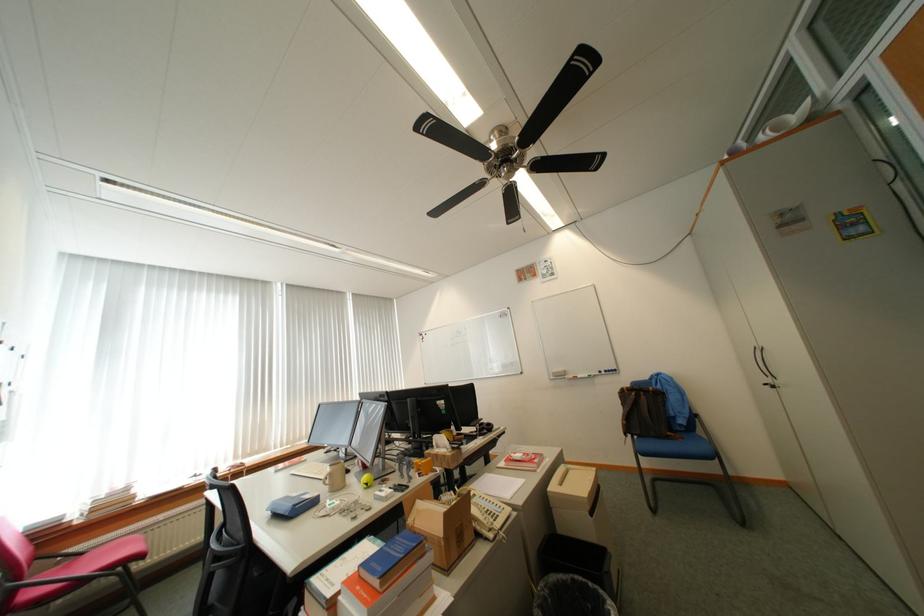
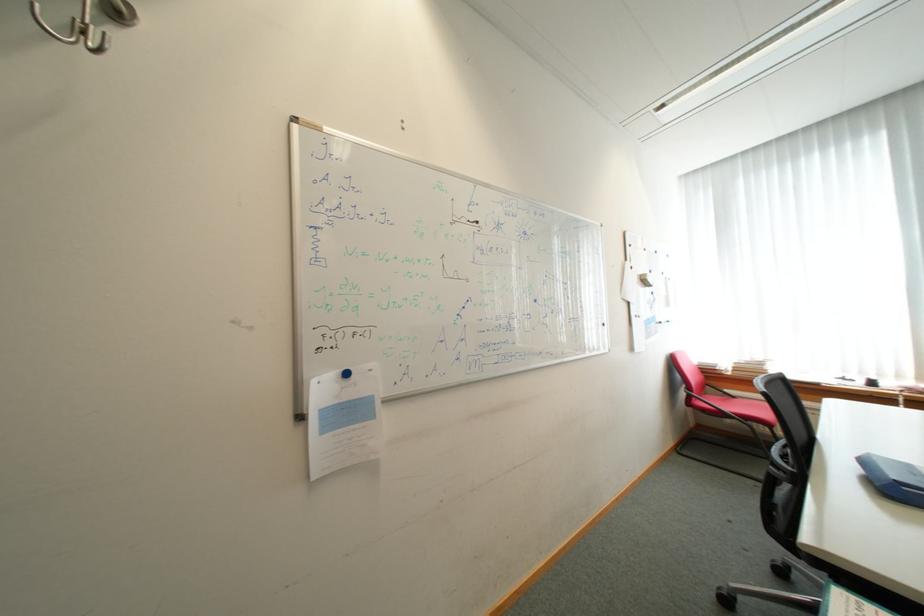
The point at (305, 507) is marked in the first image. Where is the corresponding point in the second image?

(912, 485)